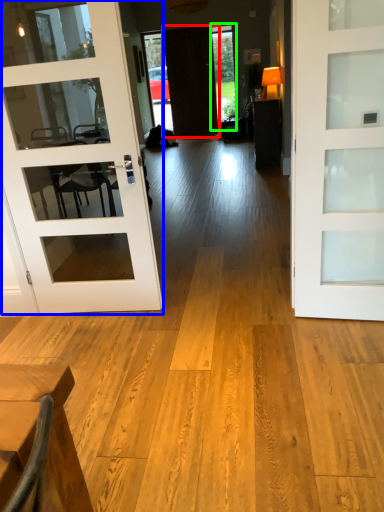
Question: Which object is positioned closest to door (highlighted by a red box)? Select from door (highlighted by a blue box) and window (highlighted by a green box).

Choices:
 (A) door
 (B) window

Answer: (B)